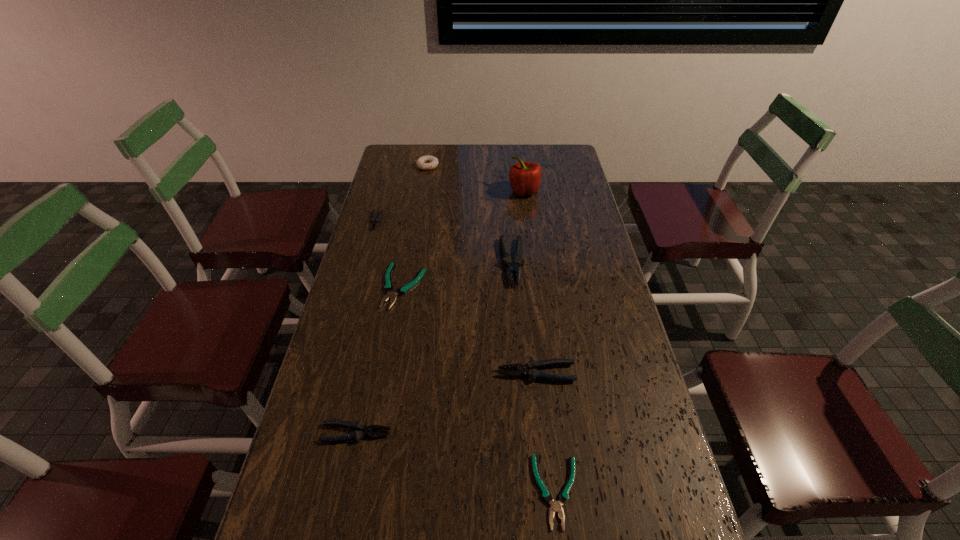
Where is `the smallest gray pliers`? Image resolution: width=960 pixels, height=540 pixels. the smallest gray pliers is located at coordinates (374, 222).

Find the location of a particular element. This screenshot has width=960, height=540. the farthest gray pliers is located at coordinates (374, 222).

Where is `the seventh tallest object`? This screenshot has width=960, height=540. the seventh tallest object is located at coordinates (388, 287).

Find the location of a particular element. the second shortest pliers is located at coordinates (388, 287).

Locate an element on the screen. the nearest object is located at coordinates (556, 506).

This screenshot has width=960, height=540. I want to click on the smaller teal pliers, so click(556, 506).

Locate an element on the screen. This screenshot has width=960, height=540. blank area located on the left of the tallest object is located at coordinates (460, 191).

Where is `free location located on the front of the white doughnut`? Image resolution: width=960 pixels, height=540 pixels. free location located on the front of the white doughnut is located at coordinates [425, 181].

In order to click on free space located at the gripping part of the tallest pliers in this screenshot , I will do `click(522, 388)`.

At what (x,y) coordinates should I click in order to perform the action: click on free space located 0.180m at the gripping part of the fifth shortest object. Please return your answer as a coordinate pair (x, y). The width and height of the screenshot is (960, 540). Looking at the image, I should click on click(x=432, y=373).